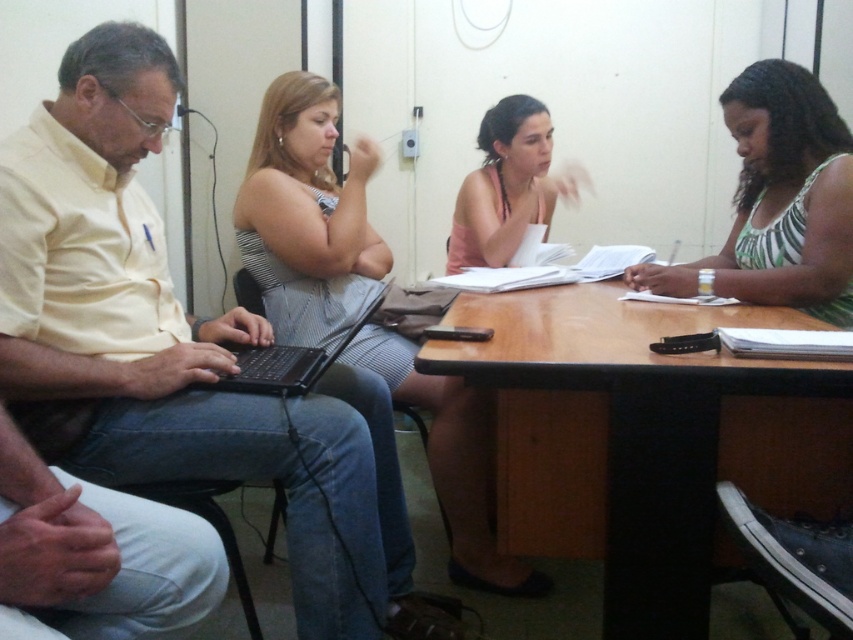
Can you confirm if brown wood table at center is positioned to the left of black plastic laptop at left?

No, brown wood table at center is not to the left of black plastic laptop at left.

The width and height of the screenshot is (853, 640). Describe the element at coordinates (645, 440) in the screenshot. I see `brown wood table at center` at that location.

At what (x,y) coordinates should I click in order to perform the action: click on brown wood table at center. Please return your answer as a coordinate pair (x, y). Looking at the image, I should click on (645, 440).

Does yellow matte shirt at left appear on the left side of matte pink shirt at center?

Correct, you'll find yellow matte shirt at left to the left of matte pink shirt at center.

Can you confirm if yellow matte shirt at left is wider than matte pink shirt at center?

Yes.

Is point (250, 336) in front of point (506, 108)?

Yes, point (250, 336) is closer to viewer.

At what (x,y) coordinates should I click in order to perform the action: click on yellow matte shirt at left. Please return your answer as a coordinate pair (x, y). The image size is (853, 640). Looking at the image, I should click on (175, 346).

Is brown wood table at center to the left of striped fabric dress at center from the viewer's perspective?

No, brown wood table at center is not to the left of striped fabric dress at center.

Does point (469, 321) come behind point (453, 474)?

No, (469, 321) is in front of (453, 474).

The image size is (853, 640). What do you see at coordinates (645, 440) in the screenshot? I see `brown wood table at center` at bounding box center [645, 440].

Find the location of `brown wood table at center`. brown wood table at center is located at coordinates (645, 440).